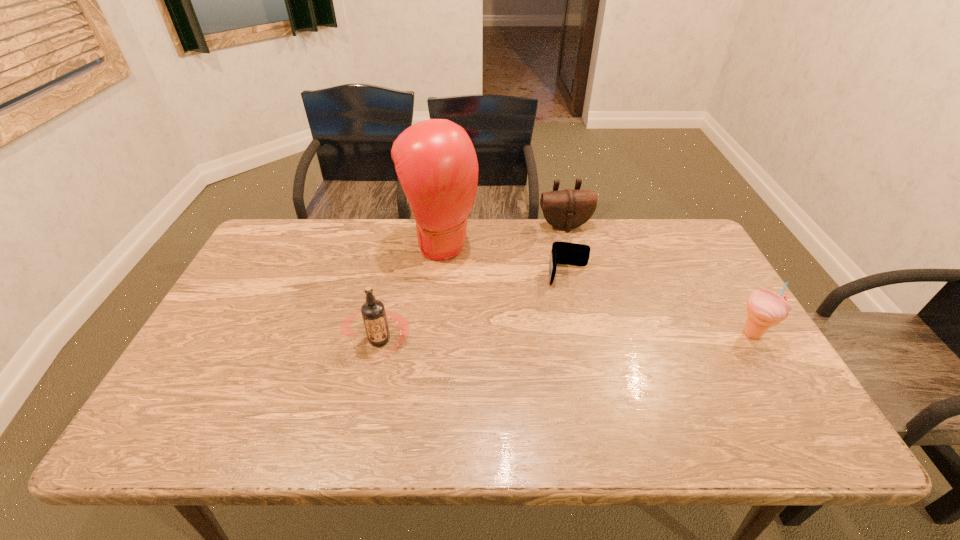
Identify the location of root beer. Image resolution: width=960 pixels, height=540 pixels. (373, 312).

This screenshot has width=960, height=540. Find the location of `the rightmost object`. the rightmost object is located at coordinates 765,308.

Where is `wallet`? Image resolution: width=960 pixels, height=540 pixels. wallet is located at coordinates (567, 253).

You are a GUI agent. You are given a task and a screenshot of the screen. Output one action in this format:
    pyautogui.click(x=<x>, y=<y>)
    Task: Click on the boxing glove
    
    Given the screenshot: What is the action you would take?
    pyautogui.click(x=435, y=161)

What are the coordinates of `pouch` in the screenshot? It's located at (567, 209).

The width and height of the screenshot is (960, 540). I want to click on free space located 0.070m on the label of the root beer, so click(x=369, y=389).

At what (x,y) coordinates should I click in order to perform the action: click on vacant space located 0.380m on the back of the rightmost object. Please return your answer as a coordinate pair (x, y). This screenshot has width=960, height=540. Looking at the image, I should click on (693, 237).

The width and height of the screenshot is (960, 540). I want to click on free location located on the outer surface of the wallet, so click(x=568, y=335).

Find the location of `vacant space located 0.210m on the outer surface of the wallet`. vacant space located 0.210m on the outer surface of the wallet is located at coordinates (568, 343).

Identify the location of free space located 0.170m on the outer surface of the wallet. The width and height of the screenshot is (960, 540). (568, 332).